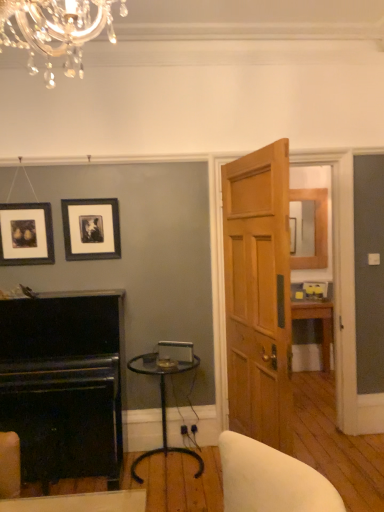
Question: Is matte black picture frame at upper left, arranged as the first picture frame when viewed from the left, spatially inside black polished wood fireplace at lower left, or outside of it?

Choices:
 (A) inside
 (B) outside

Answer: (B)

Question: Based on their positions, is matte black picture frame at upper left, arranged as the first picture frame when viewed from the left, located to the left or right of black polished wood fireplace at lower left?

Choices:
 (A) right
 (B) left

Answer: (B)

Question: Estimate the real-world distances between objects in this image. Which object is closer to the black matte picture frame at upper center, acting as the first picture frame starting from the right?

Choices:
 (A) matte black picture frame at upper left, the second picture frame positioned from the right
 (B) black polished wood fireplace at lower left
 (C) light brown wooden door at center
 (D) clear glass table at center

Answer: (A)

Question: Which object is the closest to the clear glass table at center?

Choices:
 (A) black matte picture frame at upper center, placed as the second picture frame when sorted from left to right
 (B) black polished wood fireplace at lower left
 (C) matte black picture frame at upper left, the second picture frame positioned from the right
 (D) light brown wooden door at center

Answer: (B)